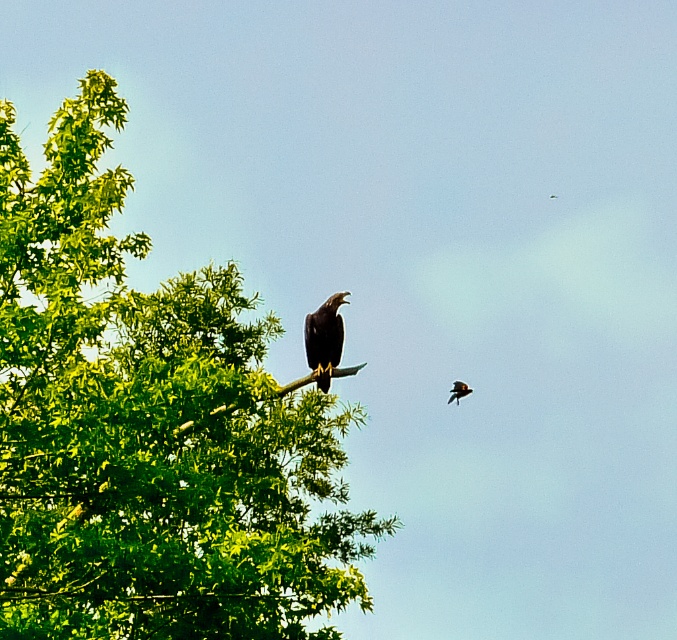
Question: Can you confirm if green leafy tree at left is bigger than shiny black eagle at upper center?

Choices:
 (A) no
 (B) yes

Answer: (B)

Question: Considering the relative positions of green leafy tree at left and shiny black eagle at upper center in the image provided, where is green leafy tree at left located with respect to shiny black eagle at upper center?

Choices:
 (A) right
 (B) left

Answer: (B)

Question: Which object is positioned farthest from the shiny black crow at upper right?

Choices:
 (A) shiny black eagle at upper center
 (B) green leafy tree at left

Answer: (B)

Question: Which object appears closest to the camera in this image?

Choices:
 (A) green leafy tree at left
 (B) shiny black crow at upper right
 (C) shiny black eagle at upper center

Answer: (A)

Question: Is green leafy tree at left above shiny black eagle at upper center?

Choices:
 (A) yes
 (B) no

Answer: (B)

Question: Among these objects, which one is nearest to the camera?

Choices:
 (A) green leafy tree at left
 (B) shiny black eagle at upper center
 (C) shiny black crow at upper right

Answer: (A)